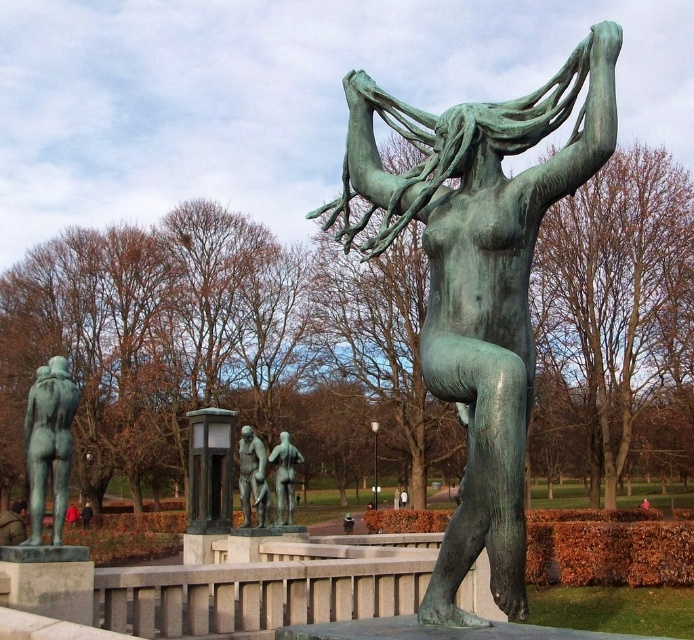
You are a photographer standing in the park and want to take a picture of both the green polished statue at left and the bronze statue at center. Which statue should you position closer to the camera to ensure both are in focus?

You should position the green polished statue at left closer to the camera because it is in front of the bronze statue at center, so adjusting focus on the closer statue will help both be in focus.

You are an artist planning to sketch the scene. You need to ensure that the proportions between the green patina bronze statue at center and the brown leather jacket at lower left are accurate. Which object should you draw wider in your sketch?

The brown leather jacket at lower left should be drawn wider in the sketch since its width is greater than the green patina bronze statue at center according to the description.